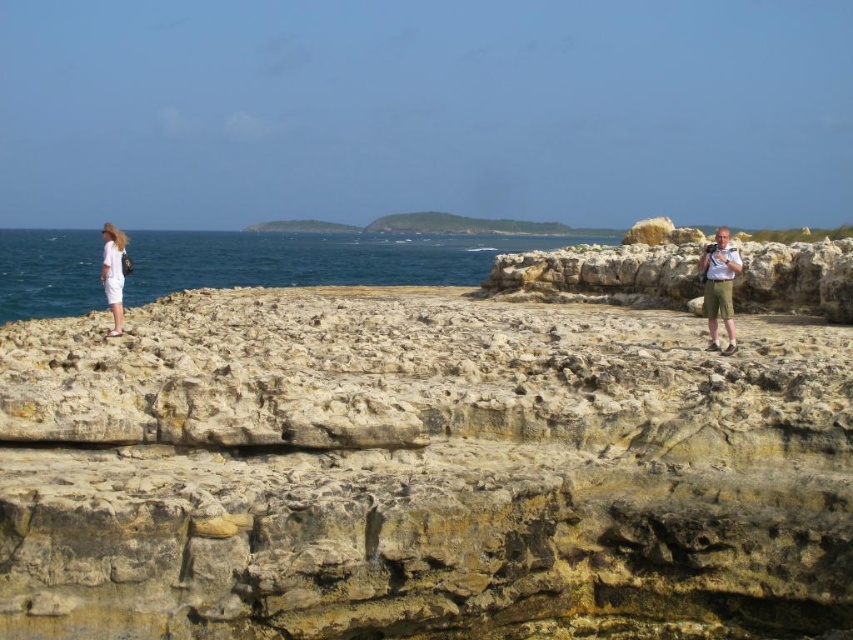
Does blue water at left appear on the left side of white cotton dress at left?

No, blue water at left is not to the left of white cotton dress at left.

Between blue water at left and white cotton dress at left, which one has more height?

Standing taller between the two is white cotton dress at left.

Where is `blue water at left`? Image resolution: width=853 pixels, height=640 pixels. blue water at left is located at coordinates (316, 259).

At what (x,y) coordinates should I click in order to perform the action: click on blue water at left. Please return your answer as a coordinate pair (x, y). Looking at the image, I should click on (316, 259).

Can you confirm if yellowish rock at center is positioned below blue water at left?

Indeed, yellowish rock at center is positioned under blue water at left.

Between yellowish rock at center and blue water at left, which one is positioned higher?

blue water at left is above.

Is point (27, 460) closer to camera compared to point (494, 241)?

That is True.

Image resolution: width=853 pixels, height=640 pixels. I want to click on yellowish rock at center, so click(421, 472).

Is yellowish rock at center to the right of white cotton dress at left from the viewer's perspective?

Indeed, yellowish rock at center is positioned on the right side of white cotton dress at left.

Between yellowish rock at center and white cotton dress at left, which one is positioned higher?

white cotton dress at left

Does point (74, 483) lie behind point (122, 252)?

No, it is not.

Find the location of a particular element. The height and width of the screenshot is (640, 853). yellowish rock at center is located at coordinates (421, 472).